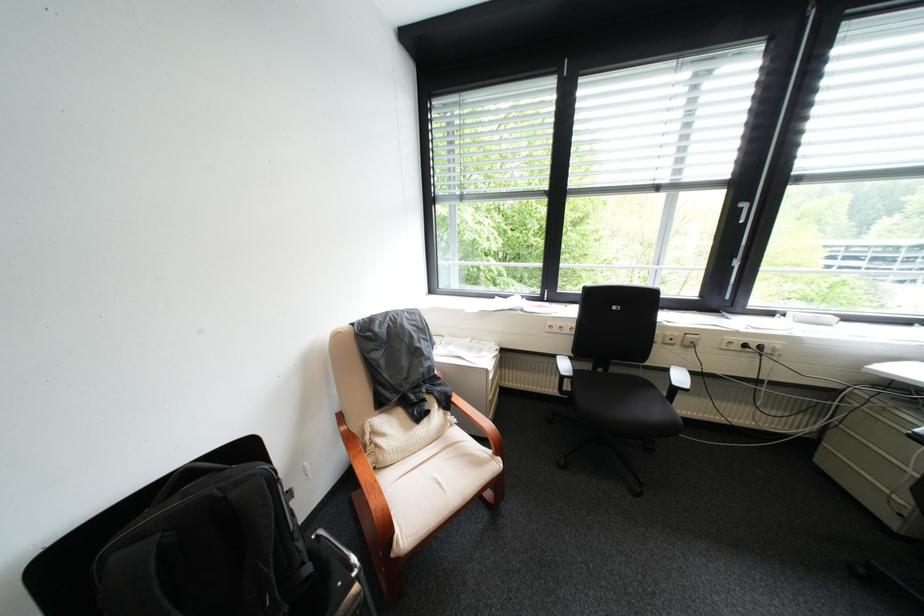
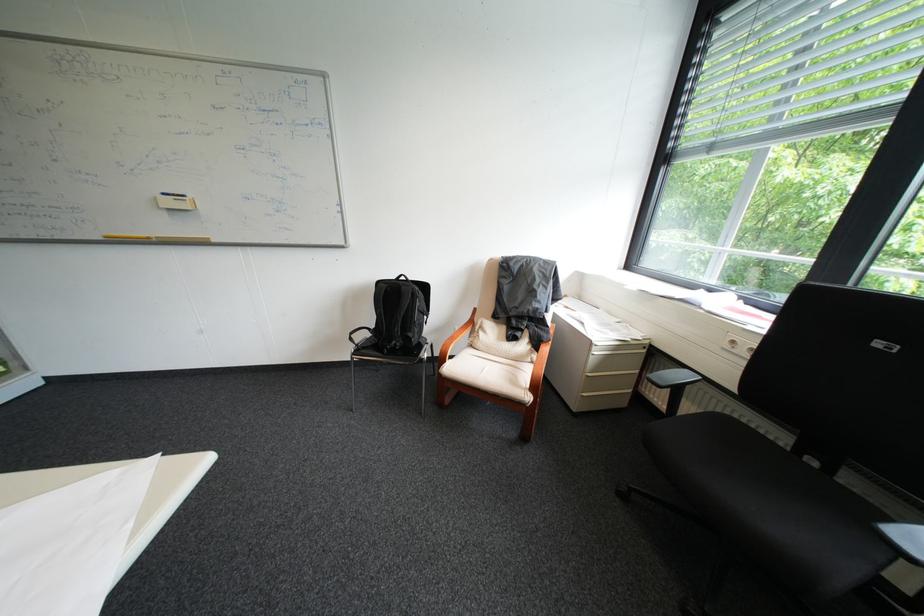
Find the pixel in the second image that matches point 406,533 in the first image.

(456, 363)